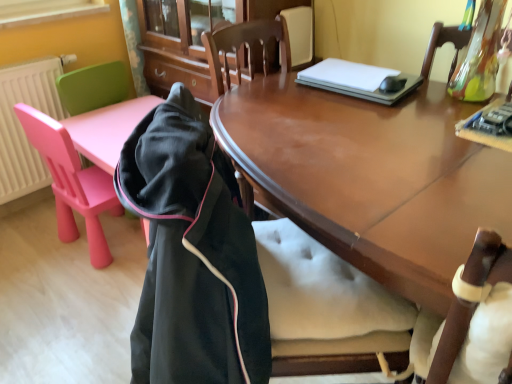
The image size is (512, 384). In order to click on blank space situated above shiny brown wood desk at center (from a real-world perspective) in this screenshot , I will do 360,135.